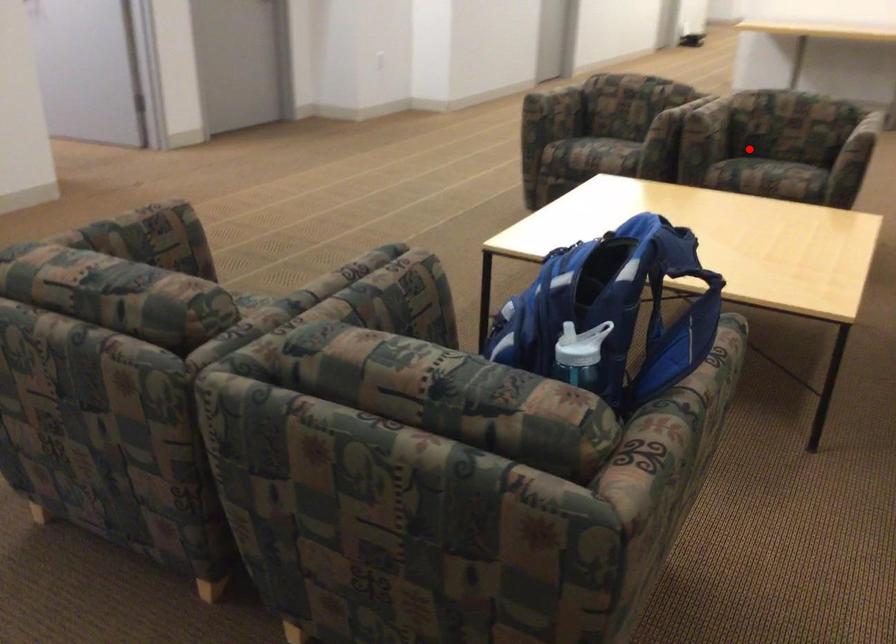
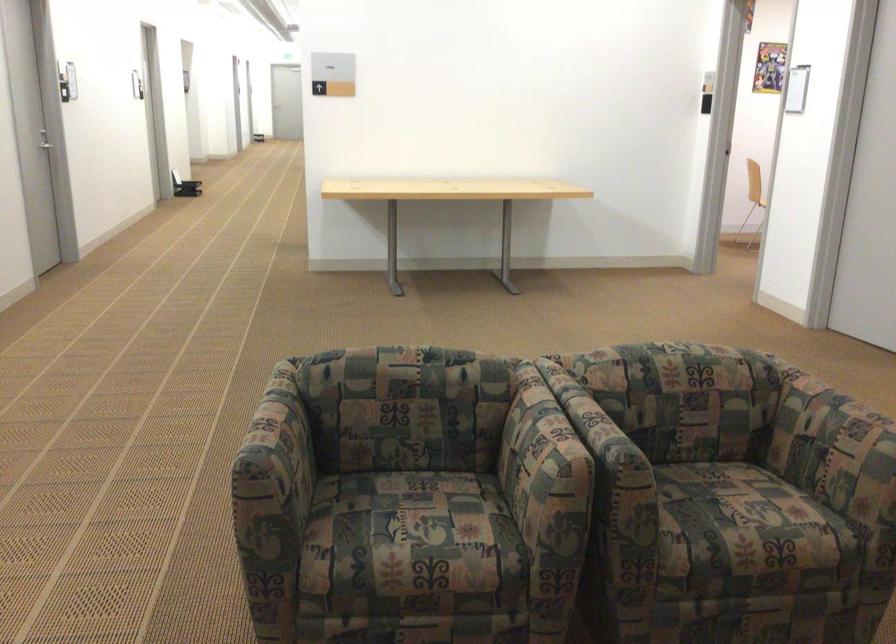
Find the pixel in the second image that matches the highlighted location in the first image.

(707, 505)